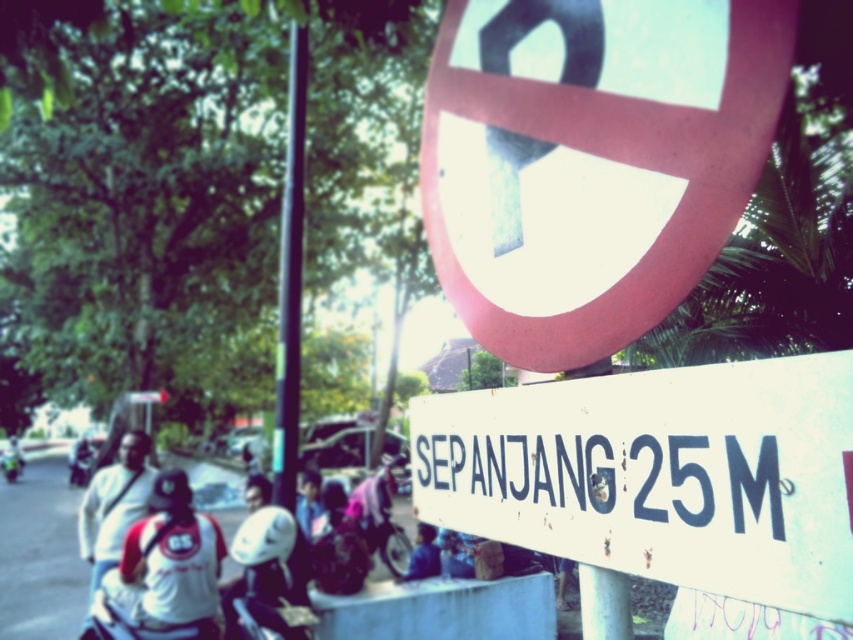
You are a pedestrian standing on the street and see the matte red circle at upper center and the blue fabric shirt at center. Which object appears wider from your perspective?

The matte red circle at upper center appears wider because its width is larger than the blue fabric shirt at center.

From the picture: You are a fashion designer observing the street scene. You notice two people wearing the white matte shirt at left and the blue fabric shirt at center. Which shirt has a wider silhouette?

The blue fabric shirt at center has a wider silhouette than the white matte shirt at left.

You are a pedestrian standing on the street and see the matte red circle at upper center and the blue fabric shirt at center. Which object is closer to you?

The matte red circle at upper center is closer to you because it is positioned over the blue fabric shirt at center, indicating it is in front.